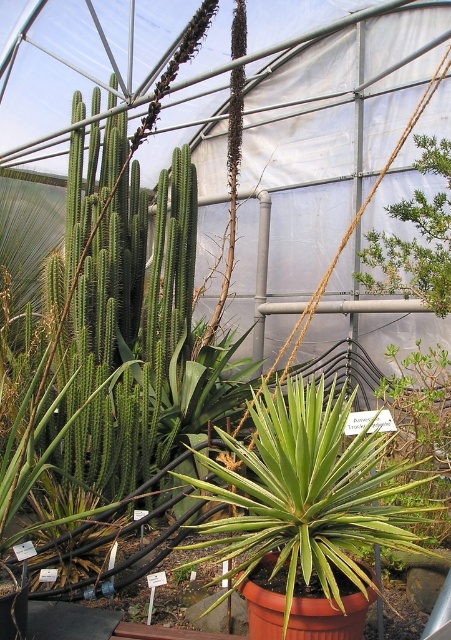
Question: In this image, where is green leafy plant at center located relative to green leafy shrub at upper right?

Choices:
 (A) below
 (B) above

Answer: (A)

Question: Which of the following is the farthest from the observer?

Choices:
 (A) (437, 225)
 (B) (419, 518)

Answer: (A)

Question: Is green leafy plant at center to the left of green leafy shrub at upper right from the viewer's perspective?

Choices:
 (A) no
 (B) yes

Answer: (B)

Question: Which of the following is the farthest from the observer?

Choices:
 (A) green leafy plant at center
 (B) green leafy shrub at upper right

Answer: (B)

Question: Where is green leafy plant at center located in relation to green leafy shrub at upper right in the image?

Choices:
 (A) left
 (B) right

Answer: (A)

Question: Which of the following is the farthest from the observer?

Choices:
 (A) green leafy shrub at upper right
 (B) green leafy plant at center

Answer: (A)